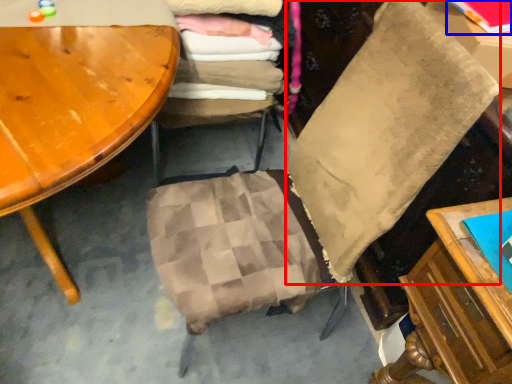
Question: Which object is closer to the camera taking this photo, pillow (highlighted by a red box) or book (highlighted by a blue box)?

Choices:
 (A) pillow
 (B) book

Answer: (A)